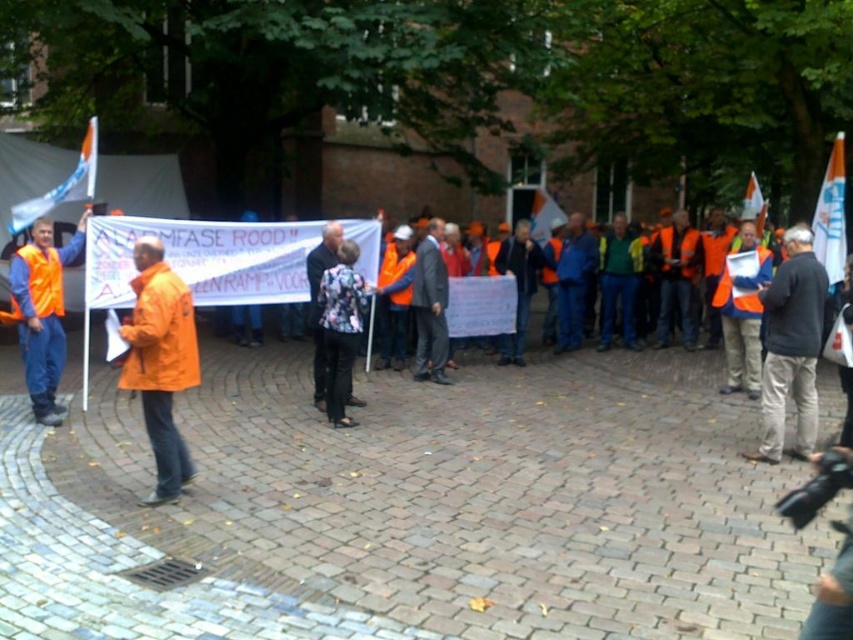
From the picture: Does orange matte jacket at center appear on the left side of dark gray jacket at center?

Indeed, orange matte jacket at center is positioned on the left side of dark gray jacket at center.

Between orange matte jacket at center and dark gray jacket at center, which one has less height?

Standing shorter between the two is orange matte jacket at center.

Who is more distant from viewer, [132,369] or [822,273]?

Point [822,273]

This screenshot has height=640, width=853. Identify the location of orange matte jacket at center. (160, 362).

Measure the distance between dark gray jacket at center and camera.

dark gray jacket at center is 23.05 feet from camera.

Is dark gray jacket at center smaller than floral-patterned jacket at center?

No, dark gray jacket at center is not smaller than floral-patterned jacket at center.

Describe the element at coordinates (791, 346) in the screenshot. This screenshot has width=853, height=640. I see `dark gray jacket at center` at that location.

Find the location of `dark gray jacket at center`. dark gray jacket at center is located at coordinates (791, 346).

Does floral-patterned jacket at center come in front of orange reflective vest at center?

Yes.

Based on the photo, can you confirm if floral-patterned jacket at center is positioned to the right of orange reflective vest at center?

In fact, floral-patterned jacket at center is to the left of orange reflective vest at center.

Where is `floral-patterned jacket at center`? floral-patterned jacket at center is located at coordinates (340, 328).

Find the location of `floral-patterned jacket at center`. floral-patterned jacket at center is located at coordinates (340, 328).